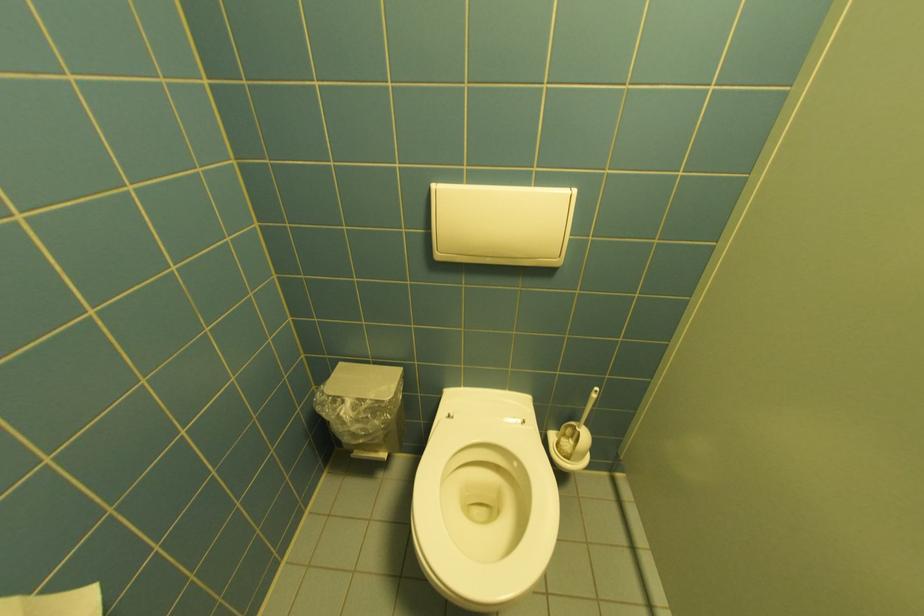
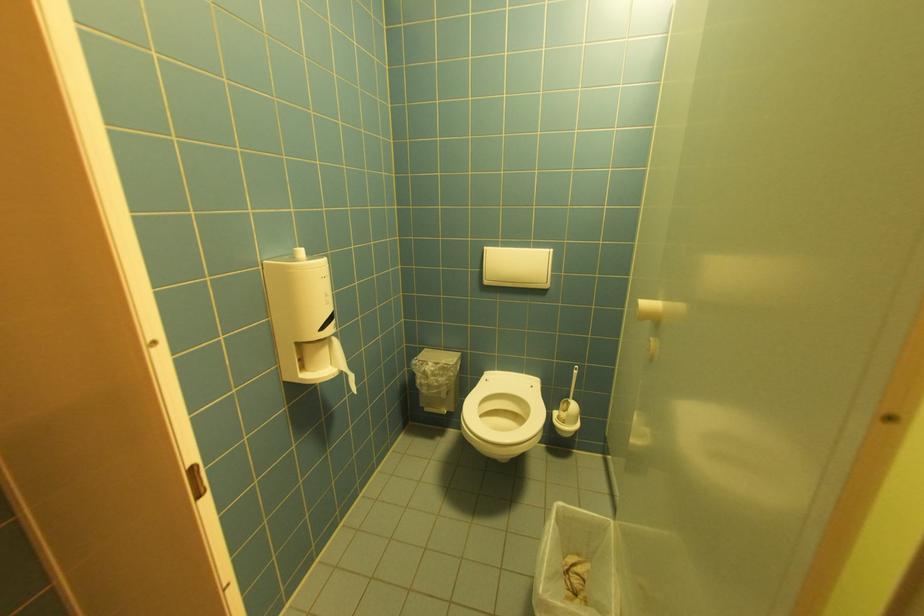
Find the pixel in the second image that matches (529,424) in the first image.

(538, 387)